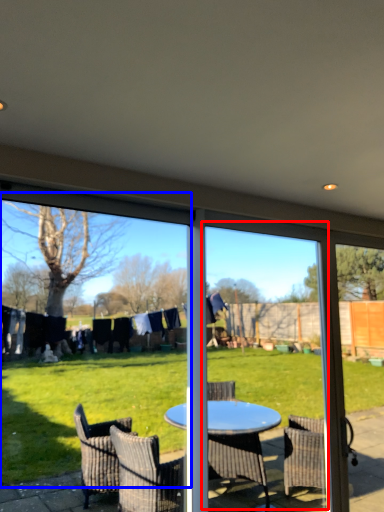
Question: Which point is further to the camera, screen door (highlighted by a red box) or window screen (highlighted by a blue box)?

Choices:
 (A) screen door
 (B) window screen

Answer: (A)